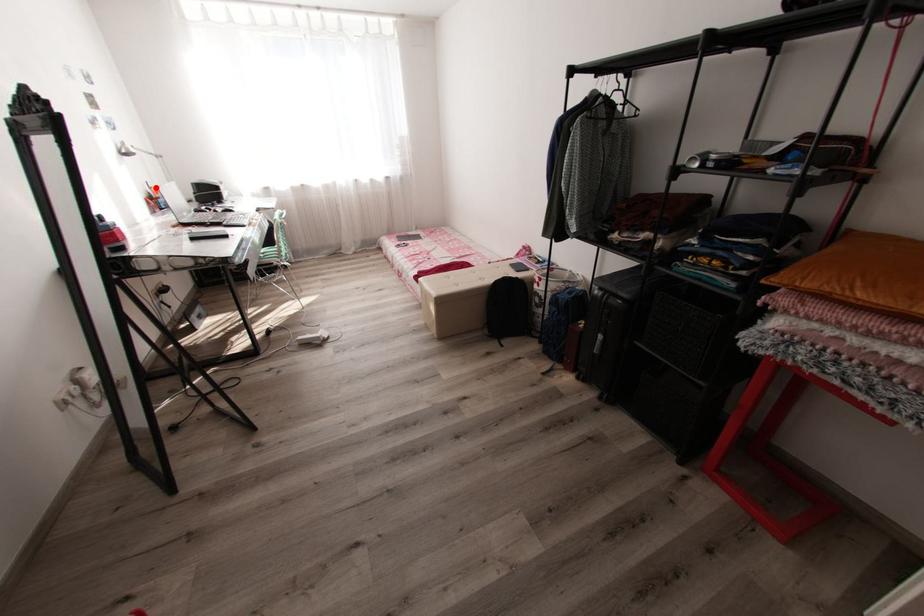
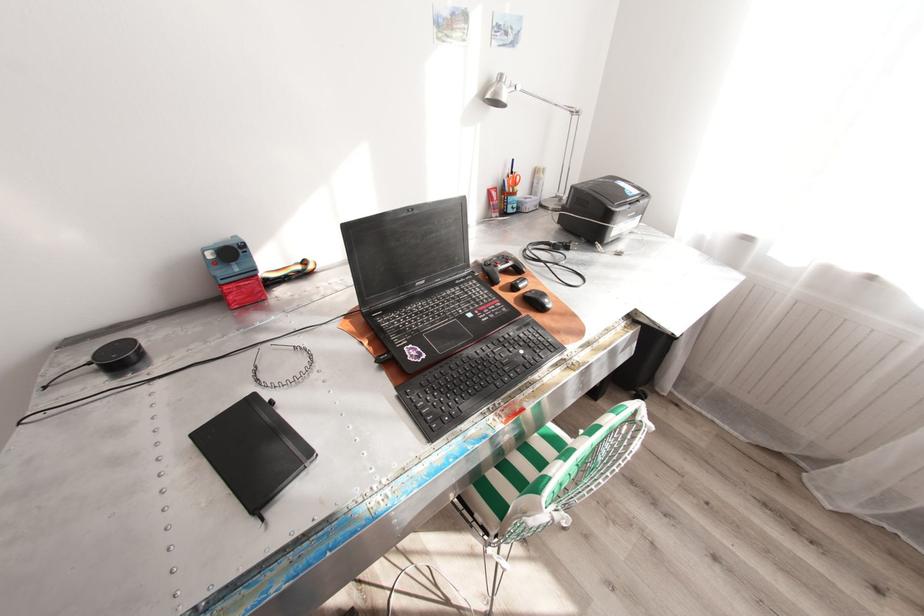
Question: A red point is marked in image1. In image2, is the corresponding 3D point closer to the camera or farther? Reply with the corresponding letter.

Choices:
 (A) The corresponding 3D point is closer.
 (B) The corresponding 3D point is farther.

Answer: (A)